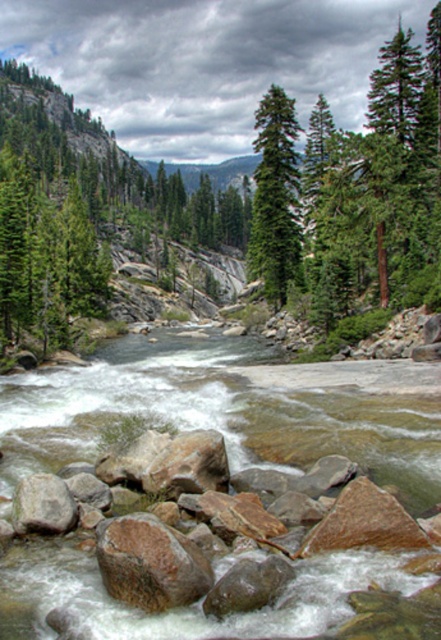
Question: Is green matte tree at center positioned behind brown rough rock at center?

Choices:
 (A) no
 (B) yes

Answer: (B)

Question: Which of these objects is positioned closest to the brown rough rock at lower left?

Choices:
 (A) green matte tree at center
 (B) brown rough rock at center
 (C) brown rock river at center

Answer: (B)

Question: Does green matte tree at center appear under brown rough rock at center?

Choices:
 (A) yes
 (B) no

Answer: (B)

Question: Which point is closer to the camera taking this photo?

Choices:
 (A) (53, 529)
 (B) (257, 232)
 (C) (164, 605)
 (D) (373, 422)

Answer: (C)

Question: Where is brown rock river at center located in relation to green matte tree at center in the image?

Choices:
 (A) below
 (B) above

Answer: (A)

Question: Estimate the real-world distances between objects in this image. Which object is farther from the brown rock river at center?

Choices:
 (A) brown rough rock at center
 (B) brown rough rock at lower left

Answer: (A)